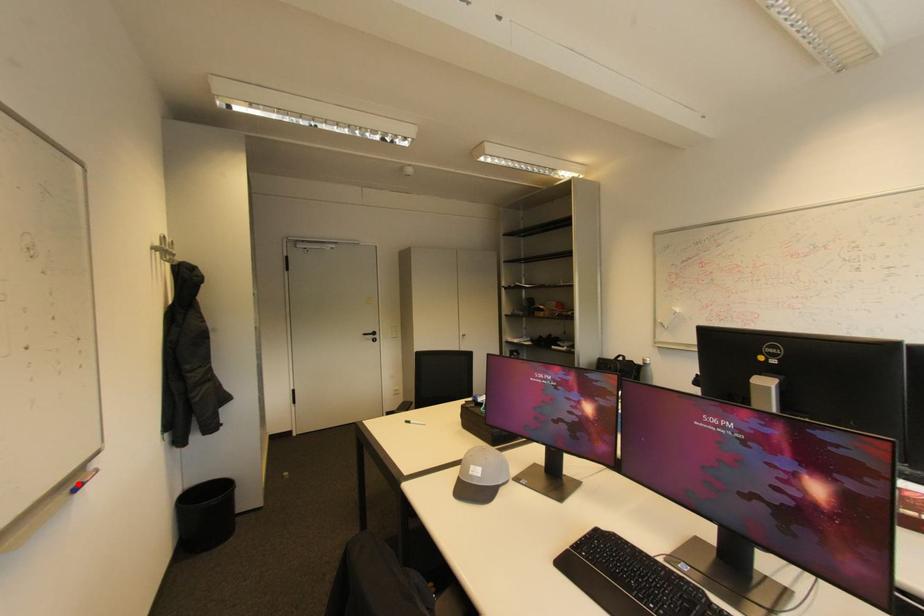
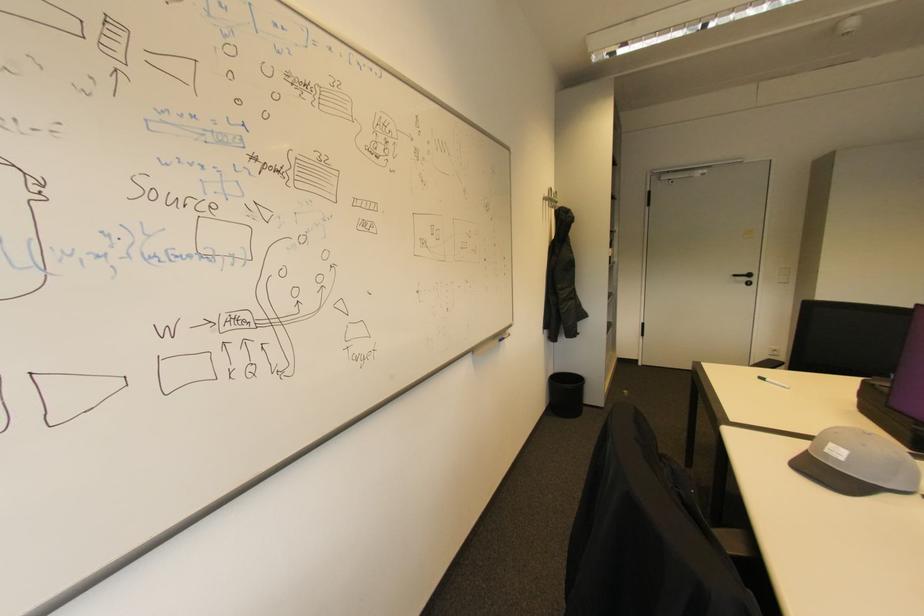
Find the pixel in the second image that matches the highlighted location in the first image.

(505, 338)